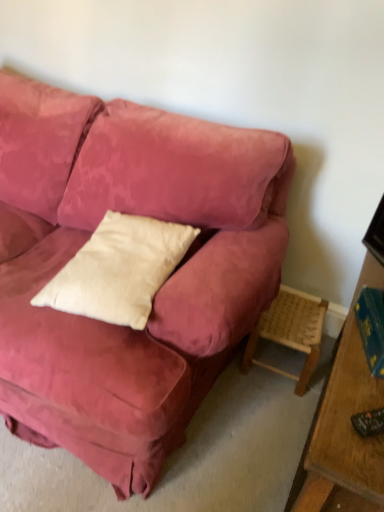
Question: From a real-world perspective, relative to white cotton pillow at center, is woven wood stool at lower right vertically above or below?

Choices:
 (A) below
 (B) above

Answer: (A)

Question: Relative to white cotton pillow at center, is woven wood stool at lower right in front or behind?

Choices:
 (A) front
 (B) behind

Answer: (B)

Question: Estimate the real-world distances between objects in this image. Which object is closer to the hardcover book at right?

Choices:
 (A) white cotton pillow at center
 (B) woven wood stool at lower right

Answer: (B)

Question: Which of these objects is positioned farthest from the woven wood stool at lower right?

Choices:
 (A) white cotton pillow at center
 (B) hardcover book at right

Answer: (A)